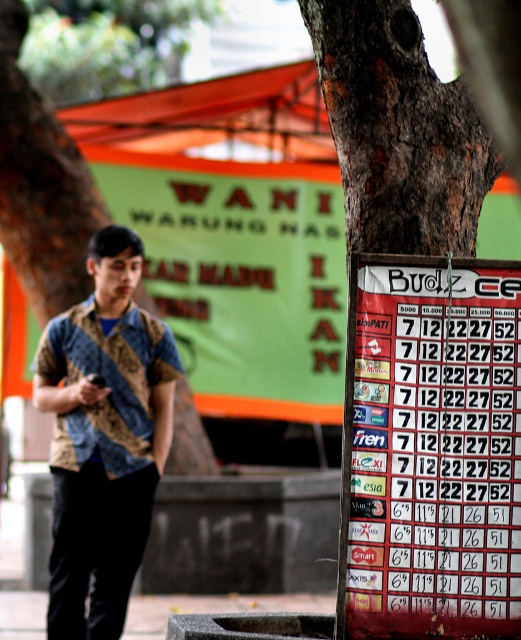
Does red paper poster at right come in front of gray concrete pavement at lower left?

Yes, it is.

Does red paper poster at right have a smaller size compared to gray concrete pavement at lower left?

Indeed, red paper poster at right has a smaller size compared to gray concrete pavement at lower left.

Is point (436, 262) positioned in front of point (18, 618)?

Yes, point (436, 262) is in front of point (18, 618).

The width and height of the screenshot is (521, 640). In order to click on red paper poster at right in this screenshot , I will do `click(431, 449)`.

The height and width of the screenshot is (640, 521). What do you see at coordinates (104, 436) in the screenshot?
I see `batik shirt at left` at bounding box center [104, 436].

Is batik shirt at left to the left of gray concrete pavement at lower left from the viewer's perspective?

Indeed, batik shirt at left is positioned on the left side of gray concrete pavement at lower left.

Is point (118, 460) closer to viewer compared to point (325, 605)?

Yes.

The image size is (521, 640). What are the coordinates of `batik shirt at left` in the screenshot? It's located at (104, 436).

Can you confirm if camouflage fabric shirt at left is positioned below gray concrete pavement at lower left?

No.

Is camouflage fabric shirt at left positioned before gray concrete pavement at lower left?

Yes.

Locate an element on the screen. The height and width of the screenshot is (640, 521). camouflage fabric shirt at left is located at coordinates [106, 385].

Where is `camouflage fabric shirt at left`? The height and width of the screenshot is (640, 521). camouflage fabric shirt at left is located at coordinates (106, 385).